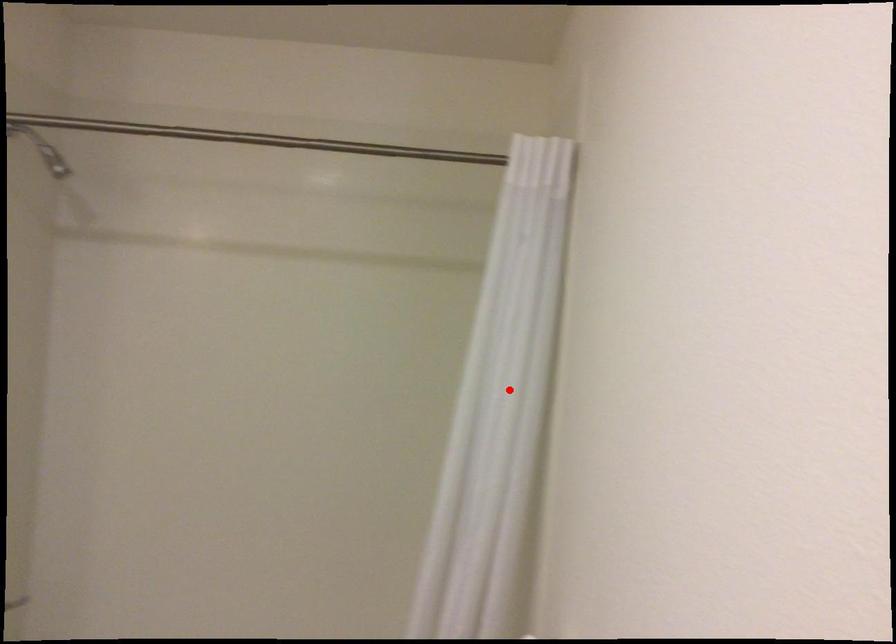
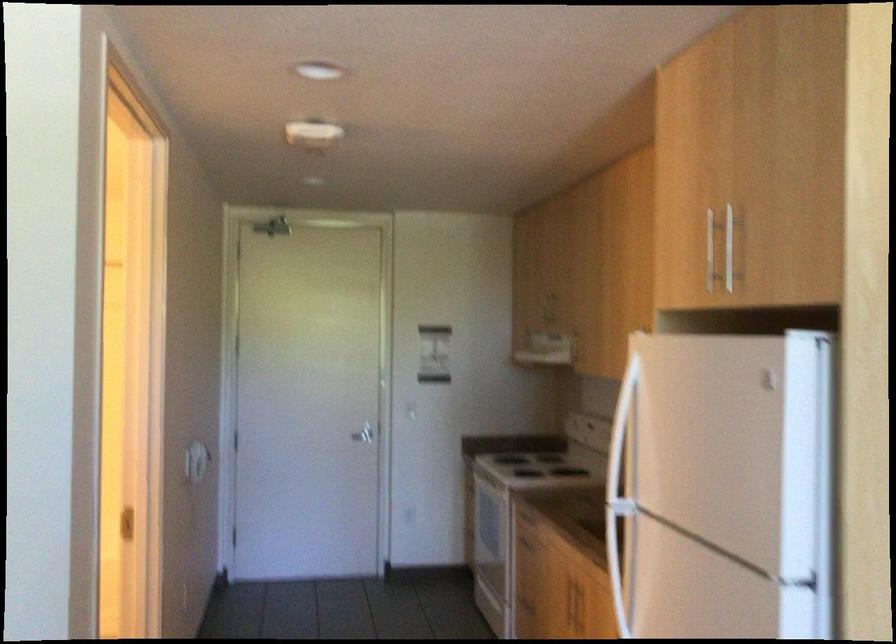
Question: I am providing you with two images of the same scene from different viewpoints. A red point is marked on the first image. Can you still see the location of the red point in image 2?

Choices:
 (A) Yes
 (B) No

Answer: (B)